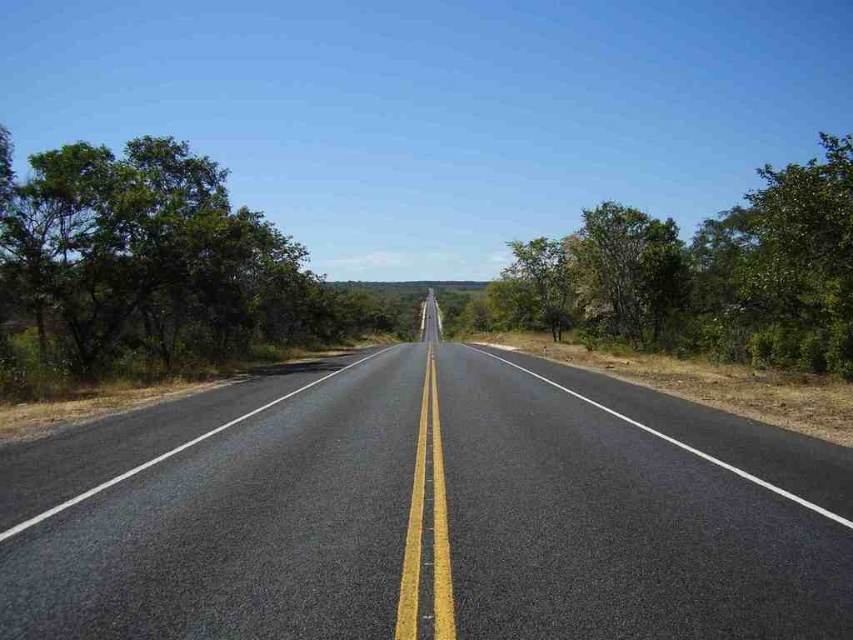
Question: Considering the relative positions of asphalt road at center and green leafy tree at left in the image provided, where is asphalt road at center located with respect to green leafy tree at left?

Choices:
 (A) right
 (B) left

Answer: (A)

Question: Does green leafy tree at left have a larger size compared to green leafy tree at right?

Choices:
 (A) yes
 (B) no

Answer: (B)

Question: Which point is closer to the camera?

Choices:
 (A) (260, 566)
 (B) (51, 195)
 (C) (666, 308)

Answer: (A)

Question: Can you confirm if green leafy tree at left is smaller than green leafy tree at right?

Choices:
 (A) no
 (B) yes

Answer: (B)

Question: Among these points, which one is nearest to the camera?

Choices:
 (A) (62, 252)
 (B) (608, 296)
 (C) (416, 388)

Answer: (C)

Question: Based on their relative distances, which object is farther from the asphalt road at center?

Choices:
 (A) green leafy tree at left
 (B) green leafy tree at right

Answer: (B)